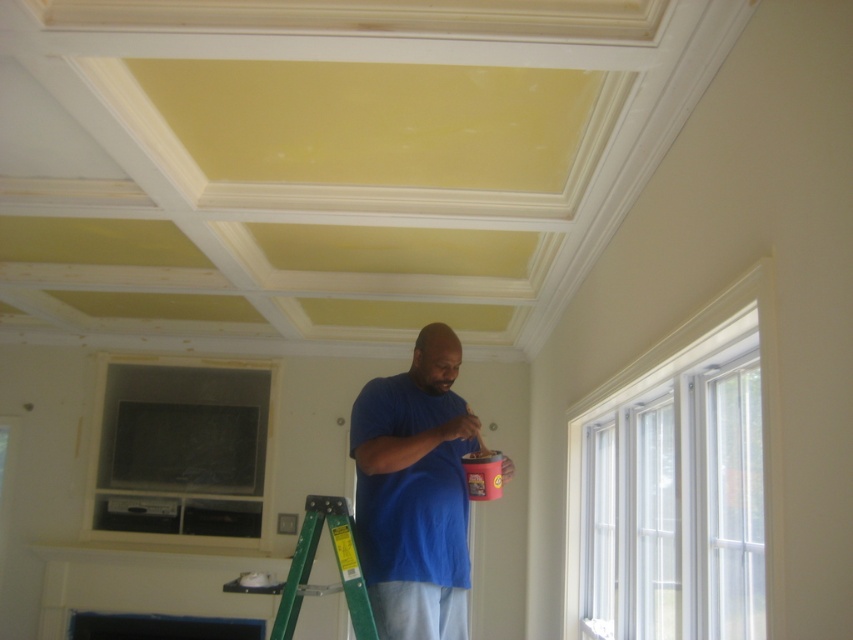
You are standing in the room and notice two points marked in the scene. Which point is closer to you, point (x=374, y=467) or point (x=280, y=624)?

Point (x=280, y=624) is closer to you because it is less further to the camera than point (x=374, y=467).

You are an interior designer observing the renovation scene. You notice the blue matte shirt at center and the green metallic ladder at lower center. Which object occupies more visual space in the image?

The blue matte shirt at center is larger in size than the green metallic ladder at lower center, so it occupies more visual space in the image.

You are standing in the room and see the point at coordinate (415,492). What object is this point located on?

The point at coordinate (415,492) is located on the blue matte shirt at center.